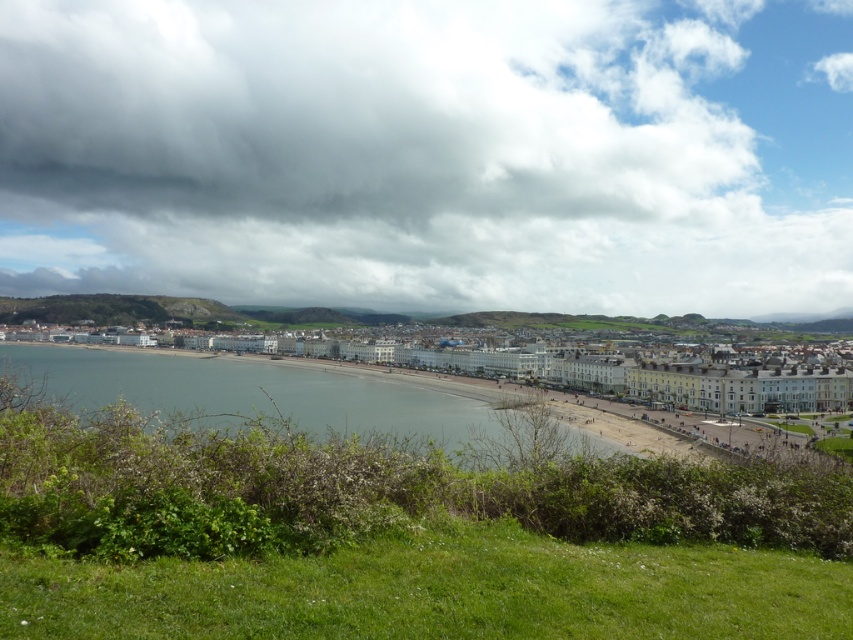
Question: Can you confirm if cloudy sky at upper center is bigger than white smooth buildings at center?

Choices:
 (A) yes
 (B) no

Answer: (A)

Question: Which point appears farthest from the camera in this image?

Choices:
 (A) (106, 221)
 (B) (474, 362)

Answer: (A)

Question: Considering the real-world distances, which object is closest to the blue water at lower center?

Choices:
 (A) white smooth buildings at center
 (B) cloudy sky at upper center

Answer: (A)

Question: Considering the real-world distances, which object is closest to the white smooth buildings at center?

Choices:
 (A) cloudy sky at upper center
 (B) blue water at lower center

Answer: (B)

Question: Can you confirm if cloudy sky at upper center is bigger than white smooth buildings at center?

Choices:
 (A) yes
 (B) no

Answer: (A)

Question: Does blue water at lower center appear on the right side of white smooth buildings at center?

Choices:
 (A) yes
 (B) no

Answer: (B)